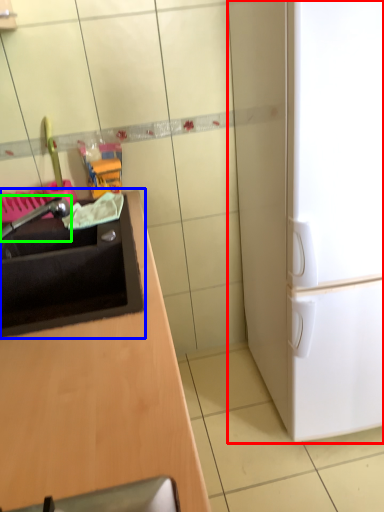
Question: Estimate the real-world distances between objects in this image. Which object is farther from refrigerator (highlighted by a red box), sink (highlighted by a blue box) or faucet (highlighted by a green box)?

Choices:
 (A) sink
 (B) faucet

Answer: (B)